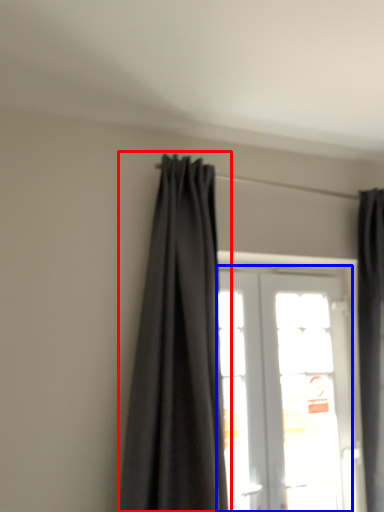
Question: Which object appears closest to the camera in this image, curtain (highlighted by a red box) or door (highlighted by a blue box)?

Choices:
 (A) curtain
 (B) door

Answer: (A)